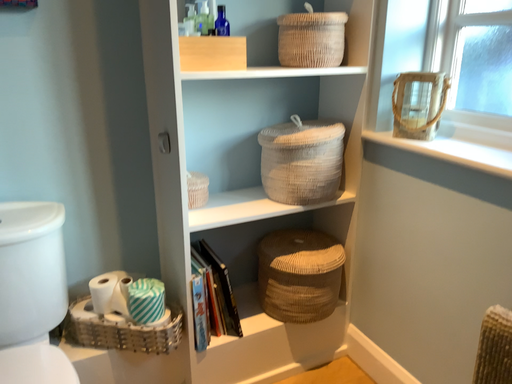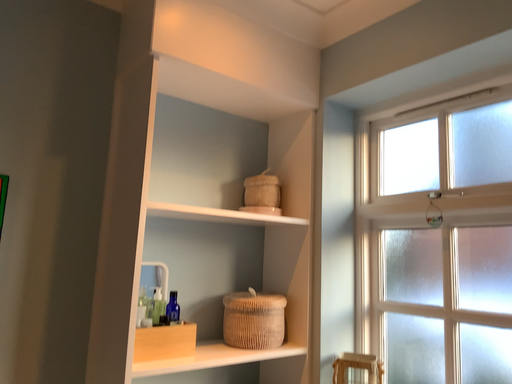
Question: How did the camera likely rotate when shooting the video?

Choices:
 (A) rotated right
 (B) rotated left

Answer: (A)